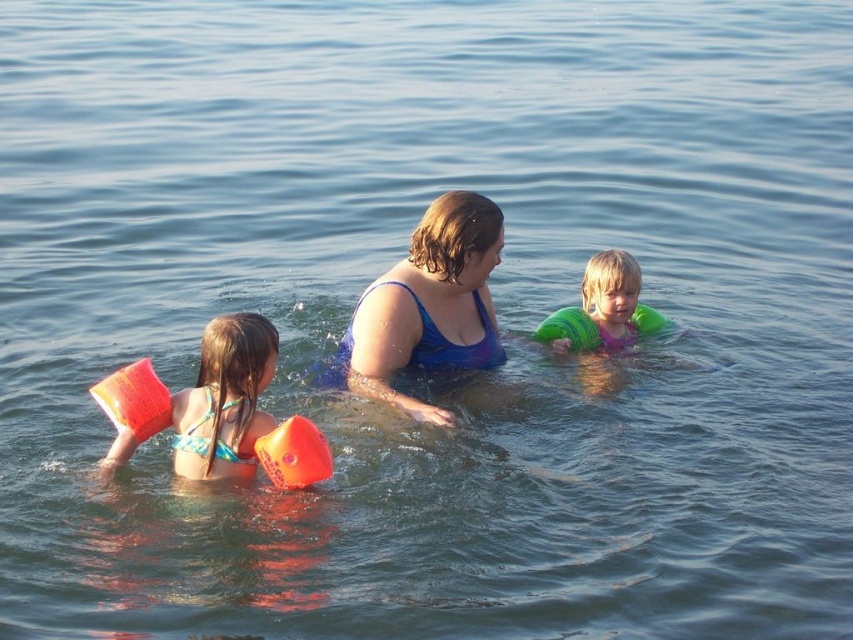
Question: Can you confirm if blue fabric swimsuit at center is smaller than matte orange floaties at left?

Choices:
 (A) no
 (B) yes

Answer: (A)

Question: Which point is farther to the camera?

Choices:
 (A) blue fabric swimsuit at center
 (B) green rubber arm bands at center

Answer: (B)

Question: Is blue fabric swimsuit at center thinner than green rubber arm bands at center?

Choices:
 (A) no
 (B) yes

Answer: (A)

Question: Based on their relative distances, which object is farther from the blue fabric swimsuit at center?

Choices:
 (A) matte orange floaties at left
 (B) orange rubber arm float at lower left
 (C) orange rubber arm float at left

Answer: (C)

Question: Which object is the closest to the orange rubber arm float at left?

Choices:
 (A) green rubber arm bands at center
 (B) blue fabric swimsuit at center
 (C) matte orange floaties at left
 (D) green rubber life jacket at center

Answer: (C)

Question: Where is blue fabric swimsuit at center located in relation to orange rubber arm float at lower left in the image?

Choices:
 (A) above
 (B) below

Answer: (A)